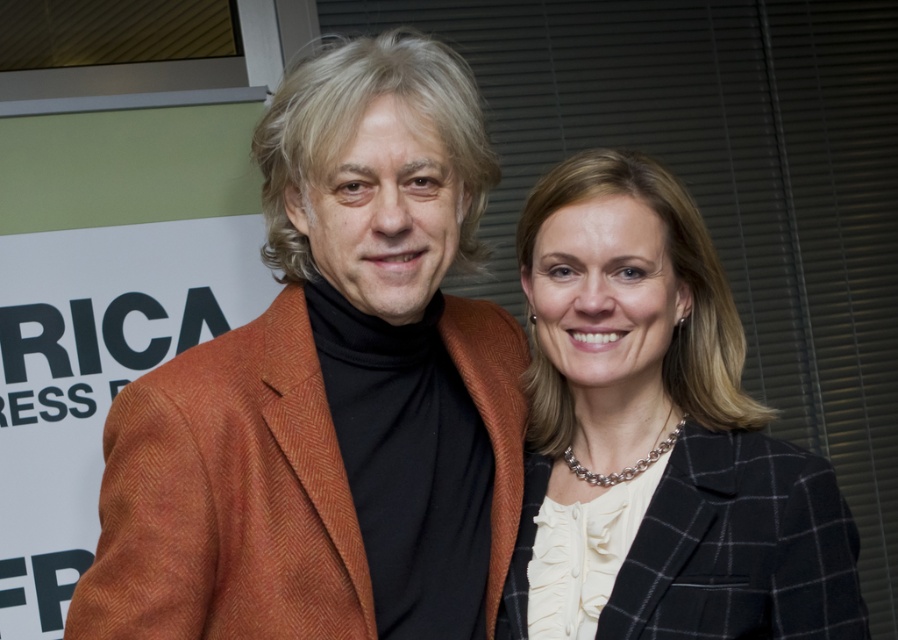
Question: Among these objects, which one is farthest from the camera?

Choices:
 (A) black textured blazer at center
 (B) orange herringbone blazer at center

Answer: (A)

Question: Does orange herringbone blazer at center appear over black textured blazer at center?

Choices:
 (A) yes
 (B) no

Answer: (A)

Question: From the image, what is the correct spatial relationship of orange herringbone blazer at center in relation to black textured blazer at center?

Choices:
 (A) right
 (B) left

Answer: (B)

Question: Which point is closer to the camera?

Choices:
 (A) black textured blazer at center
 (B) orange herringbone blazer at center

Answer: (B)

Question: Which point is farther to the camera?

Choices:
 (A) black textured blazer at center
 (B) orange herringbone blazer at center

Answer: (A)

Question: Does orange herringbone blazer at center come behind black textured blazer at center?

Choices:
 (A) no
 (B) yes

Answer: (A)